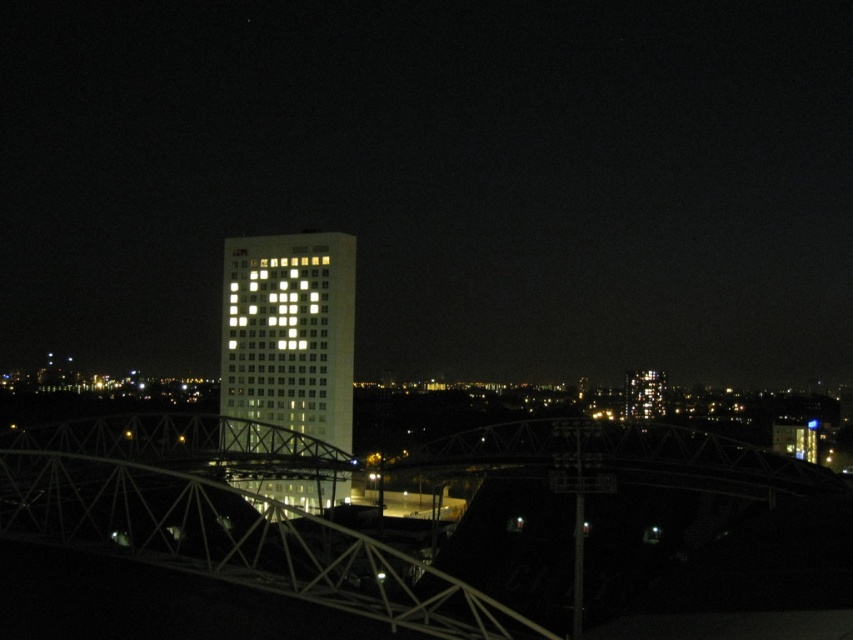
You are a city planner reviewing the urban layout. You need to determine which structure occupies more space in the foreground. Based on the image, which one is larger between the white metallic bridge at center and the white illuminated building at center?

The white metallic bridge at center is larger in size than the white illuminated building at center, so the bridge occupies more space in the foreground.